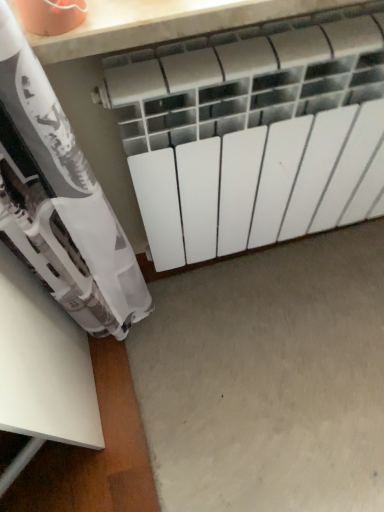
Image resolution: width=384 pixels, height=512 pixels. What do you see at coordinates (254, 138) in the screenshot? I see `white matte radiator at center` at bounding box center [254, 138].

This screenshot has height=512, width=384. Find the location of `white matte radiator at center`. white matte radiator at center is located at coordinates [254, 138].

Where is `gray matte concrete at center`? The height and width of the screenshot is (512, 384). gray matte concrete at center is located at coordinates tap(268, 378).

Image resolution: width=384 pixels, height=512 pixels. What do you see at coordinates (268, 378) in the screenshot? I see `gray matte concrete at center` at bounding box center [268, 378].

The width and height of the screenshot is (384, 512). I want to click on white matte radiator at center, so click(x=254, y=138).

Considering the relative positions of white matte radiator at center and gray matte concrete at center in the image provided, is white matte radiator at center to the left or to the right of gray matte concrete at center?

Clearly, white matte radiator at center is on the left of gray matte concrete at center in the image.

Which is behind, white matte radiator at center or gray matte concrete at center?

gray matte concrete at center is further away from the camera.

Does point (321, 40) come behind point (363, 495)?

No.

From the image's perspective, is white matte radiator at center below gray matte concrete at center?

Actually, white matte radiator at center appears above gray matte concrete at center in the image.

From a real-world perspective, which is physically above, white matte radiator at center or gray matte concrete at center?

white matte radiator at center, from a real-world perspective.

Between white matte radiator at center and gray matte concrete at center, which one has smaller width?

With smaller width is white matte radiator at center.

Who is shorter, white matte radiator at center or gray matte concrete at center?

Standing shorter between the two is gray matte concrete at center.

Which of these two, white matte radiator at center or gray matte concrete at center, is smaller?

gray matte concrete at center is smaller.

Choose the correct answer: Is white matte radiator at center inside gray matte concrete at center or outside it?

white matte radiator at center is spatially situated outside gray matte concrete at center.

Are white matte radiator at center and gray matte concrete at center far apart?

That's not correct — white matte radiator at center is a little close to gray matte concrete at center.

Is white matte radiator at center turned away from gray matte concrete at center?

white matte radiator at center is not turned away from gray matte concrete at center.

Where is `radiator on the left of gray matte concrete at center`? This screenshot has width=384, height=512. radiator on the left of gray matte concrete at center is located at coordinates (254, 138).

Is gray matte concrete at center to the left of white matte radiator at center from the viewer's perspective?

No.

Is gray matte concrete at center closer to the viewer compared to white matte radiator at center?

No, gray matte concrete at center is further to the viewer.

Considering the positions of point (194, 509) and point (184, 242), is point (194, 509) closer or farther from the camera than point (184, 242)?

Point (194, 509) appears to be closer to the viewer than point (184, 242).

From the image's perspective, between gray matte concrete at center and white matte radiator at center, who is located below?

gray matte concrete at center.

From a real-world perspective, who is located lower, gray matte concrete at center or white matte radiator at center?

gray matte concrete at center is physically lower.

Which object is thinner, gray matte concrete at center or white matte radiator at center?

With smaller width is white matte radiator at center.

Who is shorter, gray matte concrete at center or white matte radiator at center?

gray matte concrete at center.

Who is bigger, gray matte concrete at center or white matte radiator at center?

white matte radiator at center is bigger.

Does gray matte concrete at center contain white matte radiator at center?

No, white matte radiator at center is not inside gray matte concrete at center.

Consider the image. Is gray matte concrete at center with white matte radiator at center?

gray matte concrete at center is not next to white matte radiator at center, and they're not touching.

From the picture: Is gray matte concrete at center aimed at white matte radiator at center?

No, gray matte concrete at center is not facing towards white matte radiator at center.

What's the angular difference between gray matte concrete at center and white matte radiator at center's facing directions?

1.56 degrees.

This screenshot has width=384, height=512. In order to click on radiator located above the gray matte concrete at center (from a real-world perspective) in this screenshot , I will do `click(254, 138)`.

Where is `radiator located on the left of gray matte concrete at center`? The width and height of the screenshot is (384, 512). radiator located on the left of gray matte concrete at center is located at coordinates (254, 138).

The width and height of the screenshot is (384, 512). Identify the location of radiator in front of the gray matte concrete at center. pos(254,138).